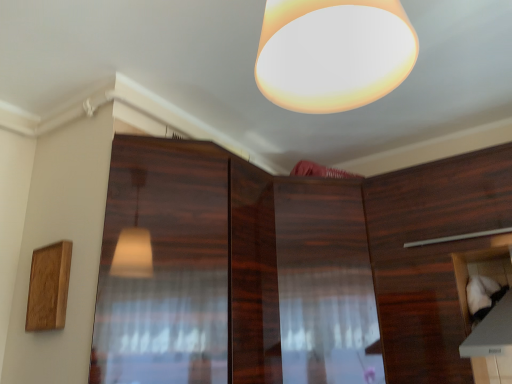
Question: In terms of size, does wooden cabinet at right, which ranks as the second cabinetry in left-to-right order, appear bigger or smaller than glossy wood screen door at center?

Choices:
 (A) small
 (B) big

Answer: (B)

Question: Does point (451, 279) appear closer or farther from the camera than point (141, 221)?

Choices:
 (A) farther
 (B) closer

Answer: (A)

Question: Which object is positioned closest to the wooden cabinet at center, which ranks as the 1th cabinetry in left-to-right order?

Choices:
 (A) matte white lampshade at upper center
 (B) white fabric at lower right, arranged as the 3th cabinetry when viewed from the left
 (C) glossy wood screen door at center
 (D) wooden cabinet at right, which ranks as the second cabinetry in right-to-left order

Answer: (D)

Question: Estimate the real-world distances between objects in this image. Which object is closer to the glossy wood screen door at center?

Choices:
 (A) white fabric at lower right, the 1th cabinetry from the right
 (B) matte white lampshade at upper center
 (C) wooden cabinet at center, arranged as the 3th cabinetry when viewed from the right
 (D) wooden cabinet at right, which ranks as the second cabinetry in left-to-right order

Answer: (C)